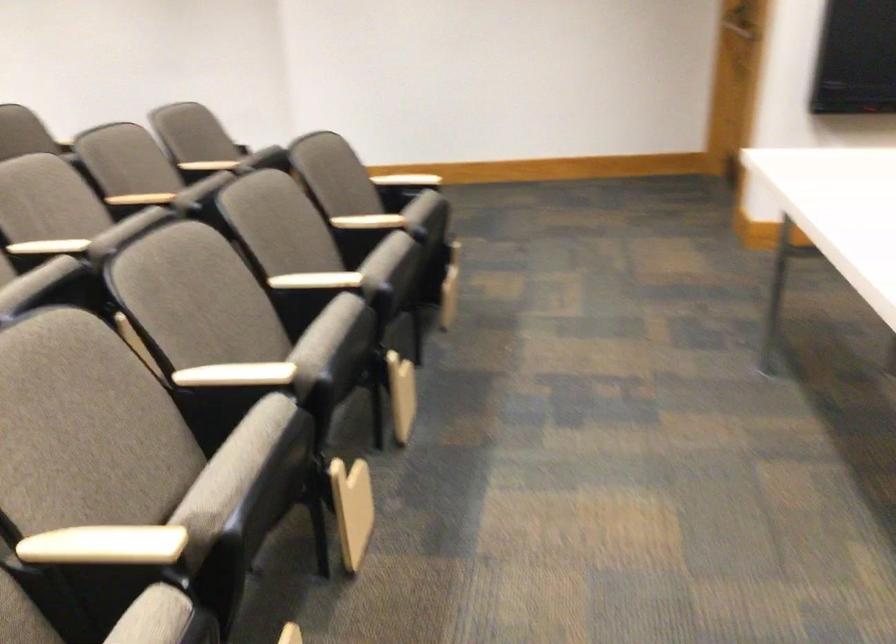
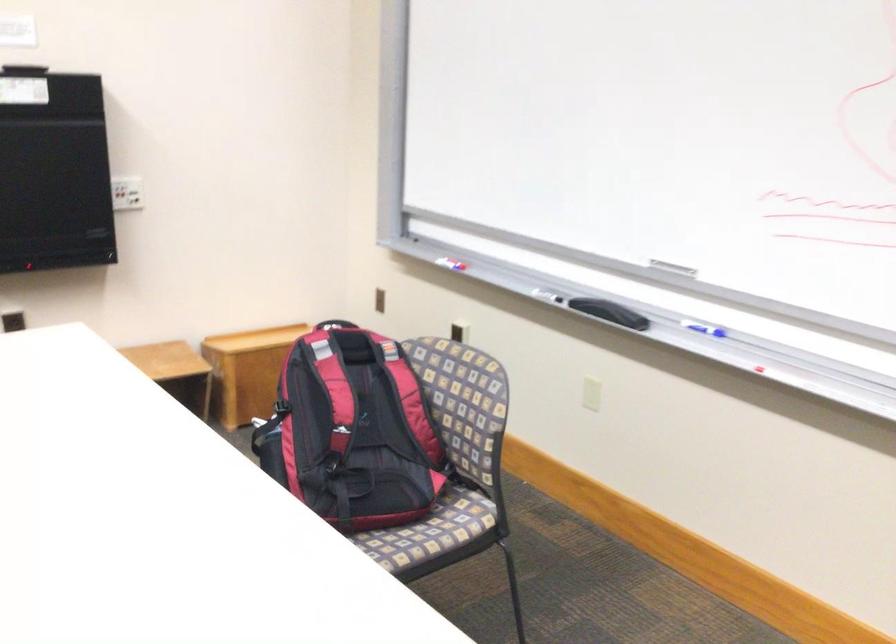
Question: The camera is either moving clockwise (left) or counter-clockwise (right) around the object. The first image is from the beginning of the video and the second image is from the end. Is the camera moving left or right when shooting the video?

Choices:
 (A) Left
 (B) Right

Answer: (A)